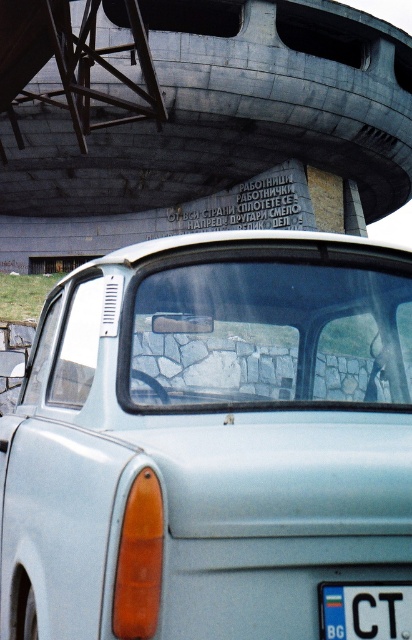
You are standing at the viewpoint where the image was taken. There are two points marked in the image, one at coordinates point (257, 342) and the other at point (323, 620). Which of these points is closer to you?

Point (323, 620) is closer to you because point (257, 342) is behind it.

You are a delivery drone that needs to fly from the gray concrete overpass at upper center to the white plastic license plate at center. The drone has a maximum flight distance of 20 meters. Can you reach the license plate without exceeding your maximum range?

The gray concrete overpass at upper center is 23.14 meters away from the white plastic license plate at center, which exceeds the drone maximum flight distance of 20 meters. The drone cannot reach the license plate without exceeding its maximum range.

You are a photographer trying to capture the gray concrete overpass at upper center and the white plastic license plate at center in a single shot. Considering their sizes, which object would appear larger in the photo?

The gray concrete overpass at upper center would appear larger in the photo because it is much taller than the white plastic license plate at center.